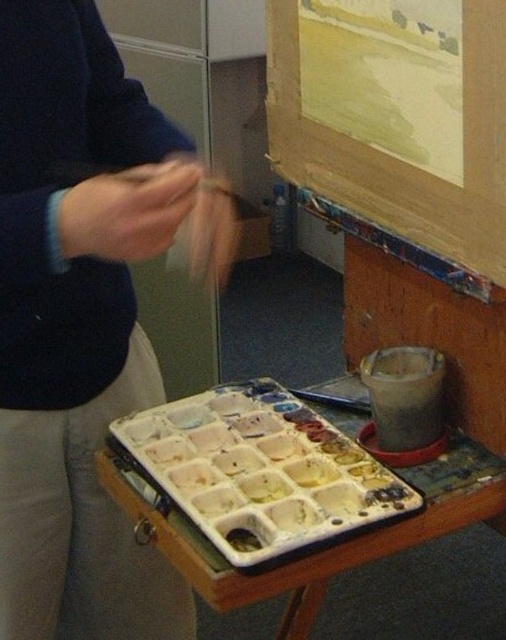
You are an artist who wants to reach the matte black sweater at upper left to adjust your sleeves. If your arm can extend 60 centimeters, can you comfortably reach it without moving your chair?

The matte black sweater at upper left is 71.58 centimeters away from the camera. Since your arm can only extend 60 centimeters, you cannot comfortably reach it without moving your chair.

You are an artist who wants to place the white matte plastic tray at lower center on top of the matte black sweater at upper left. Based on their sizes, will the tray fit without hanging over the edges?

The matte black sweater at upper left has a larger size compared to the white matte plastic tray at lower center, so the tray will fit without hanging over the edges.

You are an artist preparing your workspace. You have a matte black sweater at upper left and a white matte plastic tray at lower center. Which object is narrower in width?

The matte black sweater at upper left is thinner than the white matte plastic tray at lower center, so the matte black sweater at upper left is narrower in width.